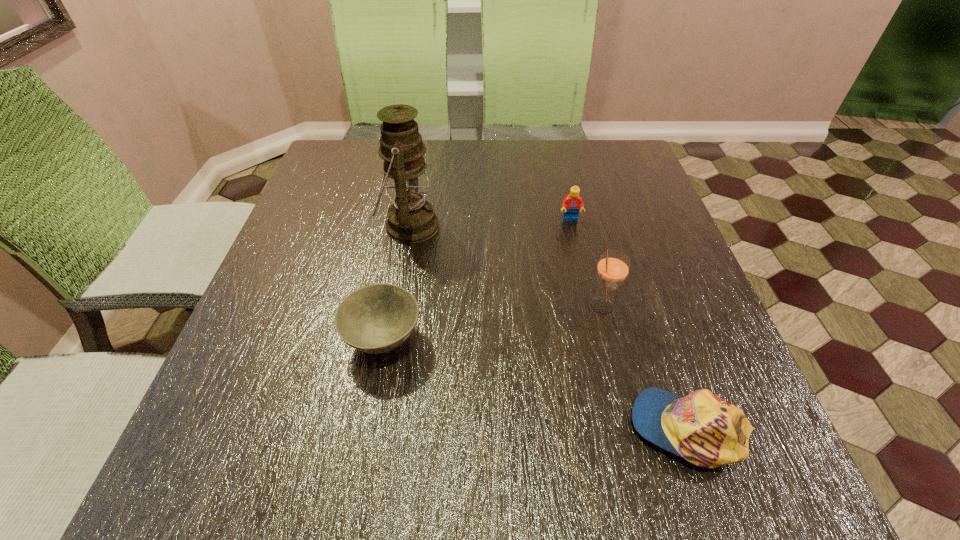
Where is `the tallest object`? Image resolution: width=960 pixels, height=540 pixels. the tallest object is located at coordinates (411, 219).

Where is `straw`? straw is located at coordinates (613, 267).

Where is `Lego`? This screenshot has width=960, height=540. Lego is located at coordinates (571, 204).

I want to click on bowl, so click(x=377, y=318).

This screenshot has height=540, width=960. Find the location of `the nearest object`. the nearest object is located at coordinates (704, 429).

You are a GUI agent. You are given a task and a screenshot of the screen. Output one action in this format:
    pyautogui.click(x=<x>, y=<y>)
    Task: Click on the free space located on the left of the oil lamp
    
    Given the screenshot: What is the action you would take?
    pyautogui.click(x=338, y=226)

Find the location of a particular element. vacant space located 0.130m on the right of the second tallest object is located at coordinates (682, 307).

Locate an element on the screen. This screenshot has width=960, height=540. vacant space situated 0.360m on the face of the Lego is located at coordinates (599, 347).

Identify the location of vacant space situated on the back of the bowl. (398, 258).

At what (x,y) coordinates should I click in order to perform the action: click on vacant space located 0.290m on the bill of the nearest object. Please return your answer as a coordinate pair (x, y). The height and width of the screenshot is (540, 960). Looking at the image, I should click on (449, 428).